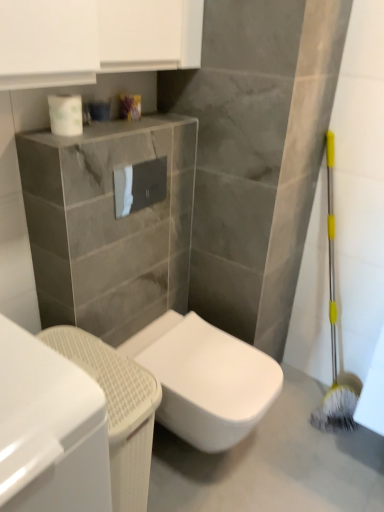
Locate an element on the screen. free space above white glossy toilet at center (from a real-world perspective) is located at coordinates [280, 452].